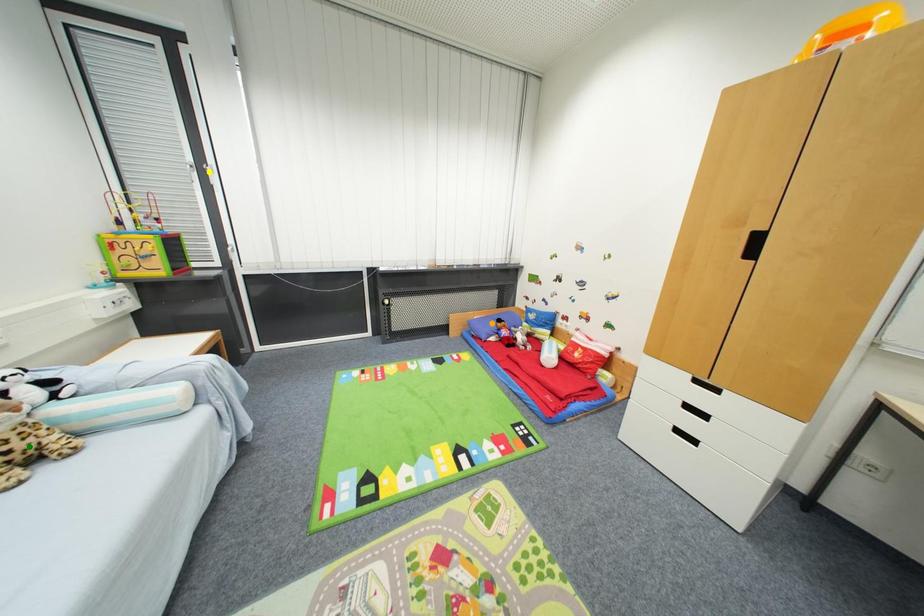
Order these from nearest to farthest:
orange point, yellow point, green point

1. orange point
2. yellow point
3. green point